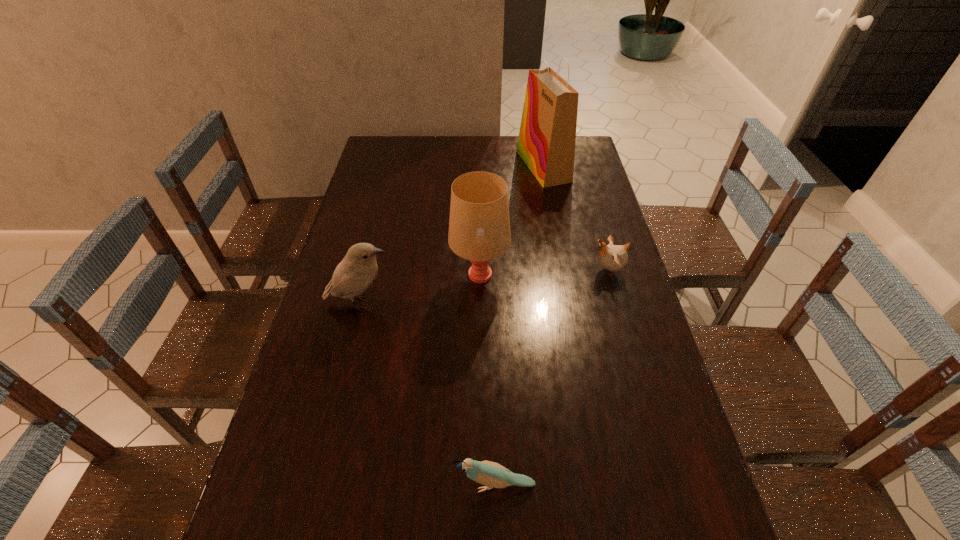
The image size is (960, 540). In order to click on shopping bag in this screenshot , I will do `click(546, 143)`.

The height and width of the screenshot is (540, 960). I want to click on the tallest object, so click(x=546, y=143).

At what (x,y) coordinates should I click in order to perform the action: click on lampshade. Please return your answer as a coordinate pair (x, y). The image size is (960, 540). Looking at the image, I should click on (479, 225).

You are a GUI agent. You are given a task and a screenshot of the screen. Output one action in this format:
    pyautogui.click(x=<x>, y=<y>)
    Task: Click on the second farthest bird
    This screenshot has width=960, height=540.
    Given the screenshot: What is the action you would take?
    pyautogui.click(x=355, y=273)

Where is `the third tallest object`? The height and width of the screenshot is (540, 960). the third tallest object is located at coordinates (355, 273).

Where is `the farthest bird`? The width and height of the screenshot is (960, 540). the farthest bird is located at coordinates (612, 257).

This screenshot has height=540, width=960. Find the location of `the second bird from left to right`. the second bird from left to right is located at coordinates (490, 474).

I want to click on the nearest bird, so click(490, 474).

I want to click on vacant space situated on the front of the tallest object, so click(x=551, y=209).

Locate an element on the screen. Image resolution: width=960 pixels, height=540 pixels. vacant space located 0.120m on the back of the lampshade is located at coordinates pos(480,232).